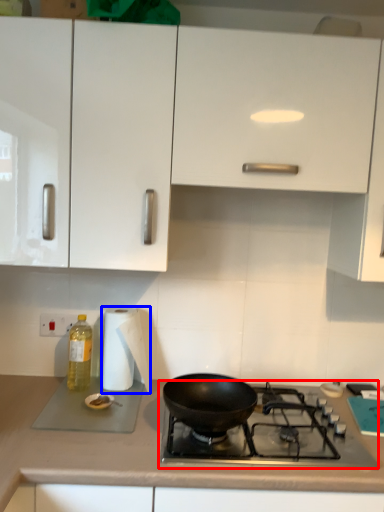
Question: Which object is closer to the camera taking this photo, gas stove (highlighted by a red box) or paper towel (highlighted by a blue box)?

Choices:
 (A) gas stove
 (B) paper towel

Answer: (A)